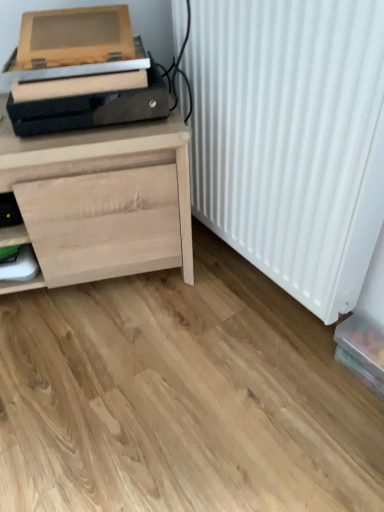
Question: Is white matte radiator at right oriented towards wooden printer at upper left?

Choices:
 (A) no
 (B) yes

Answer: (B)

Question: Is white matte radiator at right oriented away from wooden printer at upper left?

Choices:
 (A) no
 (B) yes

Answer: (A)

Question: Is white matte radiator at right at the right side of wooden printer at upper left?

Choices:
 (A) no
 (B) yes

Answer: (B)

Question: Is white matte radiator at right touching wooden printer at upper left?

Choices:
 (A) yes
 (B) no

Answer: (B)

Question: From the image's perspective, would you say white matte radiator at right is shown under wooden printer at upper left?

Choices:
 (A) yes
 (B) no

Answer: (A)

Question: From the image's perspective, does white matte radiator at right appear higher than wooden printer at upper left?

Choices:
 (A) yes
 (B) no

Answer: (B)

Question: From a real-world perspective, is white matte radiator at right located beneath natural wood chest of drawers at left?

Choices:
 (A) no
 (B) yes

Answer: (A)

Question: Can you confirm if white matte radiator at right is taller than natural wood chest of drawers at left?

Choices:
 (A) no
 (B) yes

Answer: (B)

Question: Does white matte radiator at right appear on the left side of natural wood chest of drawers at left?

Choices:
 (A) no
 (B) yes

Answer: (A)

Question: Is white matte radiator at right positioned beyond the bounds of natural wood chest of drawers at left?

Choices:
 (A) no
 (B) yes

Answer: (B)

Question: Can you confirm if white matte radiator at right is thinner than natural wood chest of drawers at left?

Choices:
 (A) no
 (B) yes

Answer: (B)

Question: Is white matte radiator at right oriented towards natural wood chest of drawers at left?

Choices:
 (A) yes
 (B) no

Answer: (A)

Question: Does white matte radiator at right lie in front of translucent plastic box at lower right?

Choices:
 (A) no
 (B) yes

Answer: (B)